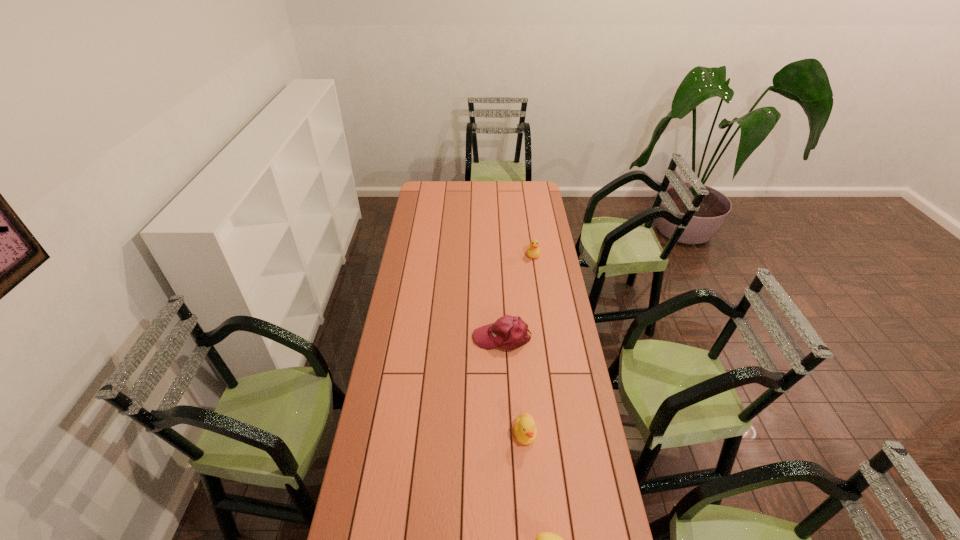
Find the location of `the third nearest object`. the third nearest object is located at coordinates (508, 332).

Locate an element on the screen. The height and width of the screenshot is (540, 960). the second farthest duck is located at coordinates (525, 430).

You are a GUI agent. You are given a task and a screenshot of the screen. Output one action in this format:
    pyautogui.click(x=<x>, y=<y>)
    Task: Click on the farthest duck
    The image size is (960, 540).
    Given the screenshot: What is the action you would take?
    pyautogui.click(x=533, y=251)

The width and height of the screenshot is (960, 540). Identify the location of vacant region located at the front of the baseball cap with the brim. (400, 338).

Identify the location of vacant space located at the front of the baseball cap with the brim. The image size is (960, 540). (417, 338).

At what (x,y) coordinates should I click in order to perform the action: click on free space located at the front of the baseball cap with the brim. Please return your answer as a coordinate pair (x, y). This screenshot has height=540, width=960. Looking at the image, I should click on (396, 338).

Locate an element on the screen. This screenshot has width=960, height=540. vacant area located at the beak of the second nearest duck is located at coordinates click(534, 536).

Where is `vacant space situated 0.100m at the beak of the farthest duck`? This screenshot has width=960, height=540. vacant space situated 0.100m at the beak of the farthest duck is located at coordinates (536, 273).

What are the coordinates of `object that is at the right edge` in the screenshot? It's located at (533, 251).

In the image, there is a desktop. What are the coordinates of `free space at the far edge` in the screenshot? It's located at [481, 185].